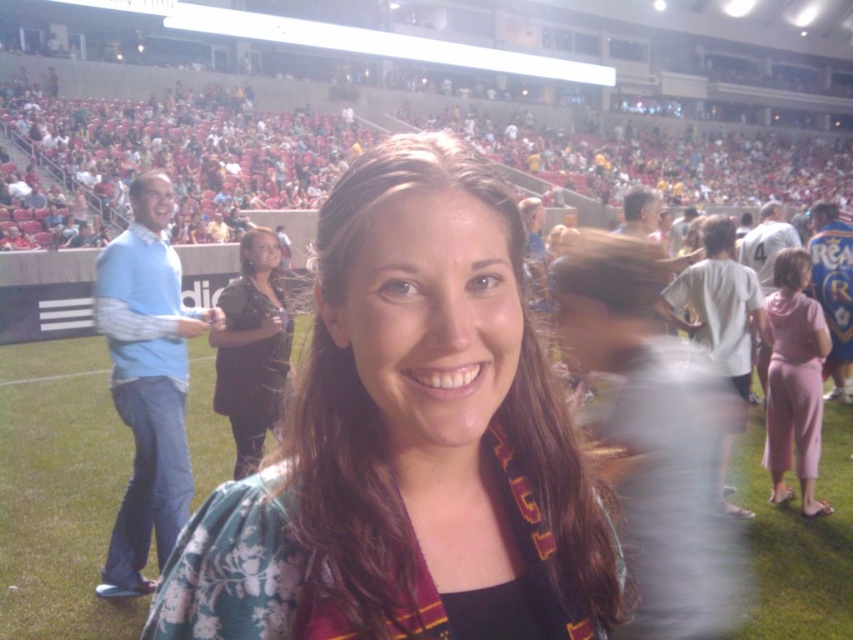
This screenshot has width=853, height=640. What do you see at coordinates (148, 381) in the screenshot?
I see `light blue sweater at left` at bounding box center [148, 381].

Locate an element on the screen. light blue sweater at left is located at coordinates (148, 381).

Describe the element at coordinates (148, 381) in the screenshot. I see `light blue sweater at left` at that location.

Image resolution: width=853 pixels, height=640 pixels. I want to click on light blue sweater at left, so click(148, 381).

Does matte red seats at upper center appear under pink fabric pants at right?

Actually, matte red seats at upper center is above pink fabric pants at right.

Can you confirm if matte red seats at upper center is positioned to the left of pink fabric pants at right?

Incorrect, matte red seats at upper center is not on the left side of pink fabric pants at right.

This screenshot has width=853, height=640. Describe the element at coordinates (183, 147) in the screenshot. I see `matte red seats at upper center` at that location.

The image size is (853, 640). What are the coordinates of `matte red seats at upper center` in the screenshot? It's located at (183, 147).

Is floral fabric shirt at center thinner than pink fabric pants at right?

Incorrect, floral fabric shirt at center's width is not less than pink fabric pants at right's.

Who is more forward, (344, 365) or (801, 476)?

Positioned in front is point (344, 365).

Describe the element at coordinates (408, 442) in the screenshot. I see `floral fabric shirt at center` at that location.

You are a GUI agent. You are given a task and a screenshot of the screen. Output one action in this format:
    pyautogui.click(x=<x>, y=<y>)
    Task: Click on the floral fabric shirt at center
    Image resolution: width=853 pixels, height=640 pixels.
    Given the screenshot: What is the action you would take?
    pyautogui.click(x=408, y=442)